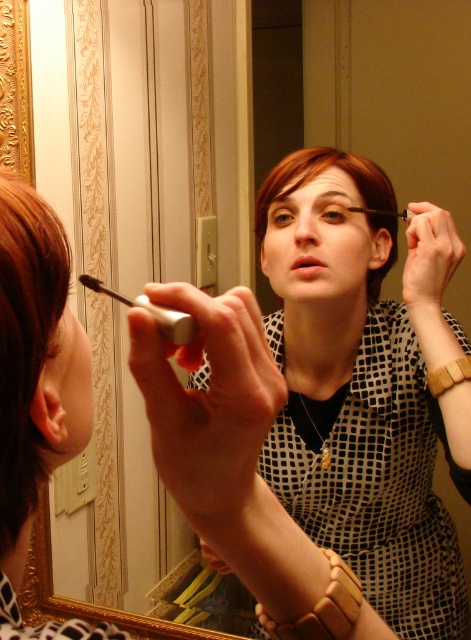
You are standing in the room and want to reach the point at coordinates point [372,291]. If your arm can extend 36 inches, can you reach it without moving your feet?

The point [372,291] is 37.95 inches away from you, which is beyond your arm extension of 36 inches. You cannot reach it without moving your feet.

You are a makeup artist trying to apply mascara to a client. The client has brown matte hair at left and you have the black matte mascara at upper center. Based on the distance between them, can you estimate if you can comfortably reach the mascara from the hair without moving your hand?

The brown matte hair at left and black matte mascara at upper center are 6.51 centimeters apart, so yes, you can comfortably reach the mascara from the hair without moving your hand as the distance is manageable for typical hand movement.